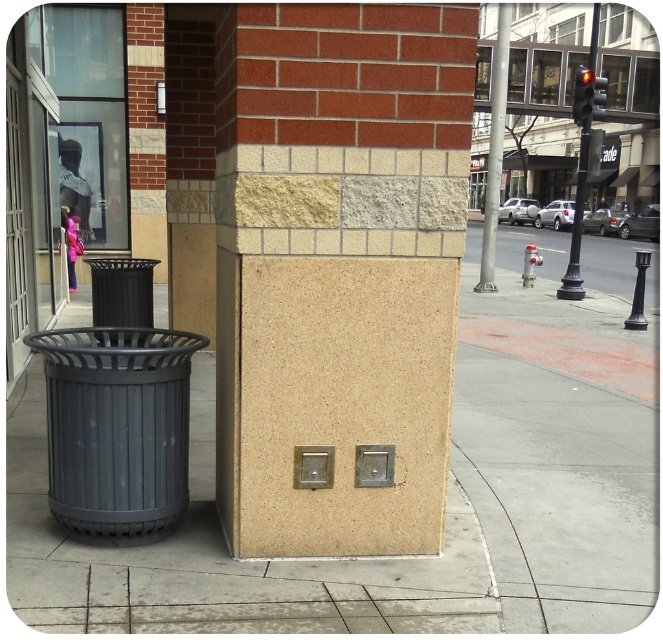
Which is below, beige textured pillar at center or metallic pole at center?

beige textured pillar at center

Is point (227, 253) farther from viewer compared to point (501, 131)?

No, (227, 253) is closer to viewer.

Identify the location of beige textured pillar at center. (337, 272).

Based on the photo, which of these two, metallic pole at center or black metal traffic light at upper right, stands shorter?

black metal traffic light at upper right is shorter.

Between metallic pole at center and black metal traffic light at upper right, which one appears on the left side from the viewer's perspective?

Positioned to the left is metallic pole at center.

Find the location of a particular element. This screenshot has height=640, width=663. metallic pole at center is located at coordinates (495, 147).

Does beige textured pillar at center have a larger size compared to black metal traffic light at upper right?

No, beige textured pillar at center is not bigger than black metal traffic light at upper right.

Does beige textured pillar at center appear over black metal traffic light at upper right?

Actually, beige textured pillar at center is below black metal traffic light at upper right.

Is point (365, 240) more distant than point (603, 97)?

No, (365, 240) is closer to viewer.

What are the coordinates of `beige textured pillar at center` in the screenshot? It's located at coord(337,272).